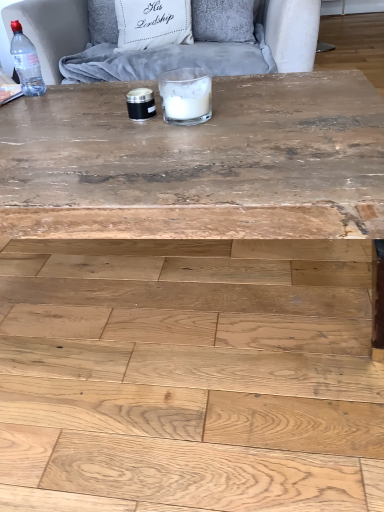
Image resolution: width=384 pixels, height=512 pixels. I want to click on vacant area that is in front of white glass candle at center, so click(x=194, y=146).